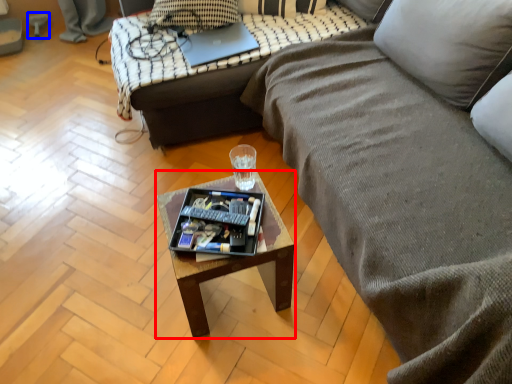
Question: Among these objects, which one is nearest to the camera, coffee table (highlighted by a red box) or swivel chair (highlighted by a blue box)?

Choices:
 (A) coffee table
 (B) swivel chair

Answer: (A)